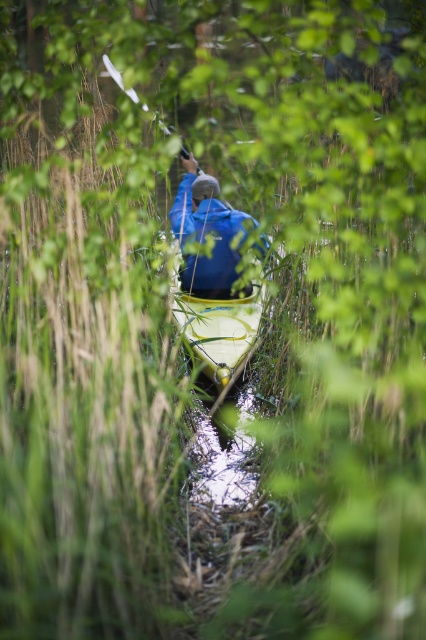
You are standing at the edge of the waterway and want to reach a specific point marked at coordinates point (238, 300). If your kayak can travel 10 meters before needing to rest, will you be able to reach that point without stopping?

The distance of point (238, 300) from viewer is 8.85 meters, so yes, you can reach it without stopping since it is within the 10 meters range of your kayak before needing to rest.

You are a photographer trying to capture the kayaker and their equipment. You want to focus on the yellow matte kayak at center and the white plastic paddle at upper center. Which object should you adjust your camera focus on first to ensure both are in sharp focus?

The yellow matte kayak at center is closer to the viewer than the white plastic paddle at upper center, so you should focus on the yellow matte kayak at center first. This will ensure the paddle also comes into focus as it is further away.